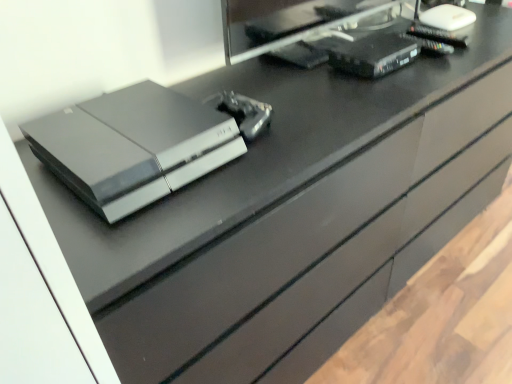
Find the location of a particular element. This screenshot has width=512, height=384. vacant area that lies to the right of black plastic router at upper right, which is the first equipment from top to bottom is located at coordinates (446, 62).